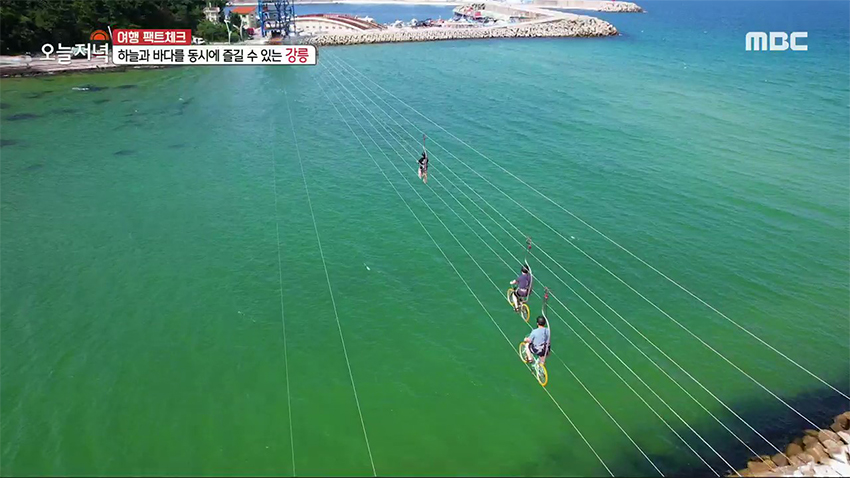
Locate an element on the screen. cable is located at coordinates (363, 423).